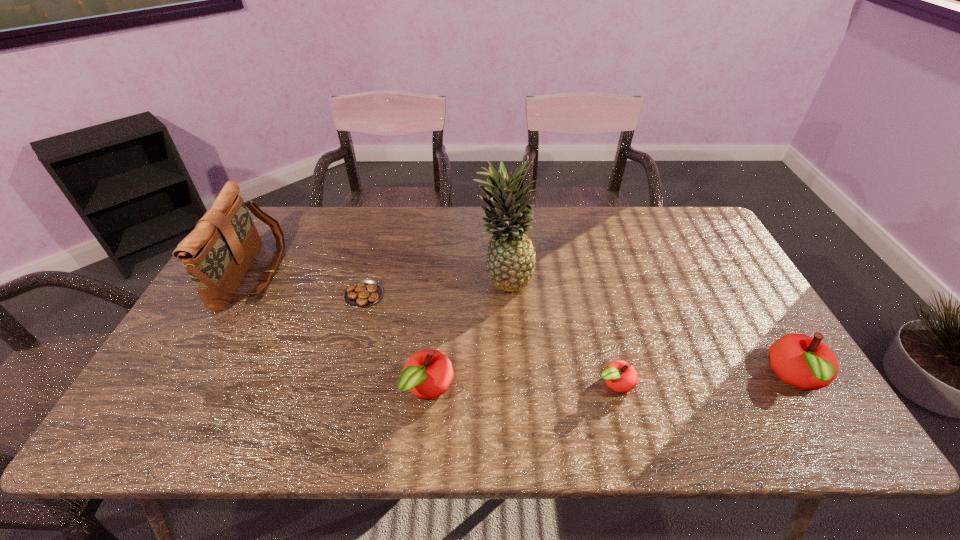
In order to click on shoulder bag in this screenshot , I will do `click(217, 254)`.

You are a GUI agent. You are given a task and a screenshot of the screen. Output one action in this format:
    pyautogui.click(x=<x>, y=<y>)
    Task: Click on the vacant space located on the left of the second shortest apple
    
    Given the screenshot: What is the action you would take?
    pyautogui.click(x=377, y=388)

The image size is (960, 540). In order to click on free space located on the right of the second object from right to left in this screenshot , I will do `click(724, 383)`.

I want to click on free space located 0.080m on the back of the rightmost apple, so click(x=764, y=326).

Identify the location of free space located 0.140m on the front of the pineapple. This screenshot has width=960, height=540. (508, 338).

The height and width of the screenshot is (540, 960). Identify the location of vacant space located 0.120m on the back of the pastry. (374, 255).

Image resolution: width=960 pixels, height=540 pixels. Identify the location of vacant space situated 0.370m on the front-facing side of the fifth shortest object. (399, 274).

This screenshot has height=540, width=960. Identify the location of object located in the far edge section of the desktop. (217, 254).

At what (x,y) coordinates should I click in order to perform the action: click on object that is at the left edge. Please return your answer as a coordinate pair (x, y). Looking at the image, I should click on (217, 254).

The height and width of the screenshot is (540, 960). I want to click on object located in the right edge section of the desktop, so click(806, 363).